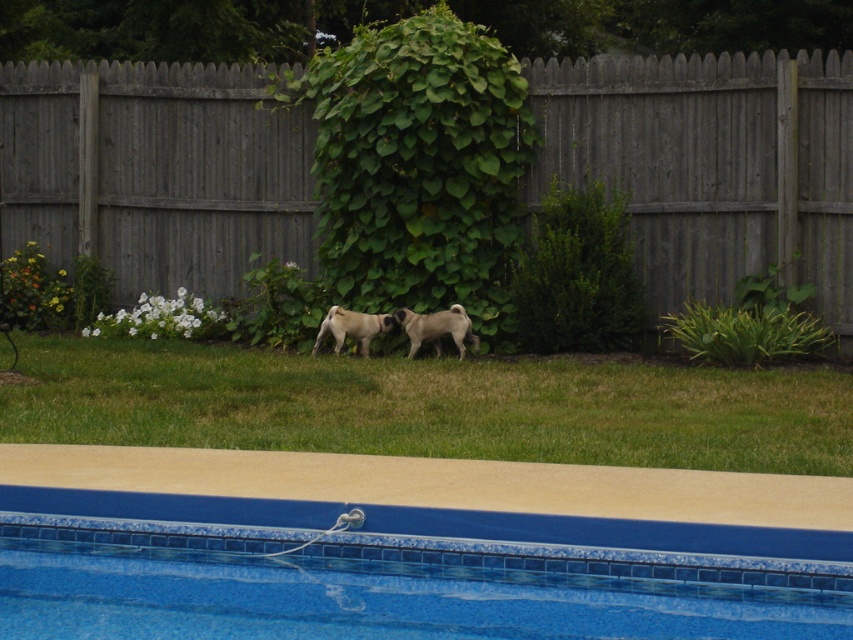
Question: Is green grass at center closer to the viewer compared to gray fur pug at center?

Choices:
 (A) yes
 (B) no

Answer: (A)

Question: Considering the relative positions of green grass at center and black fur pug at center in the image provided, where is green grass at center located with respect to black fur pug at center?

Choices:
 (A) right
 (B) left

Answer: (A)

Question: Considering the real-world distances, which object is closest to the green grass at center?

Choices:
 (A) gray wood fence at center
 (B) black fur pug at center
 (C) gray fur pug at center
 (D) blue tile swimming pool at lower center

Answer: (C)

Question: Can you confirm if green grass at center is wider than black fur pug at center?

Choices:
 (A) yes
 (B) no

Answer: (A)

Question: Which point is closer to the camera?

Choices:
 (A) gray fur pug at center
 (B) black fur pug at center
 (C) green grass at center

Answer: (C)

Question: Which point is closer to the camera?

Choices:
 (A) (381, 314)
 (B) (97, 385)
 (C) (659, 596)

Answer: (C)